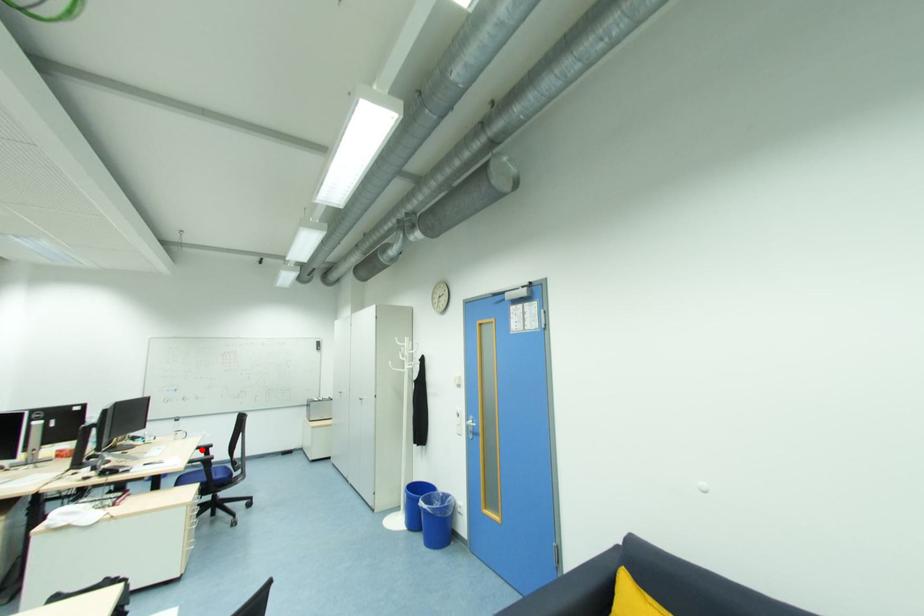
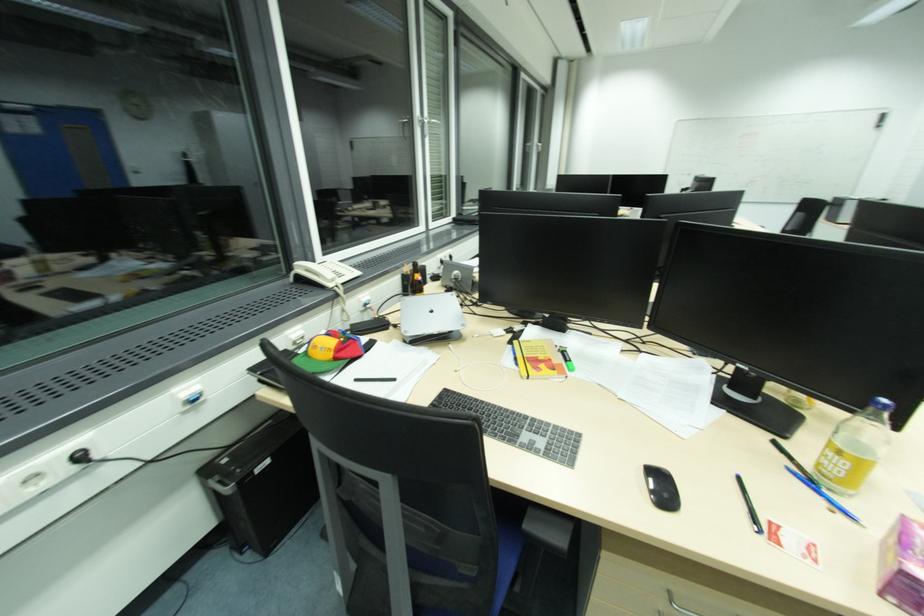
Question: I am providing you with two images of the same scene from different viewpoints. A red point is marked on the first image. Can you still see the location of the red point in image 2?

Choices:
 (A) Yes
 (B) No

Answer: (B)